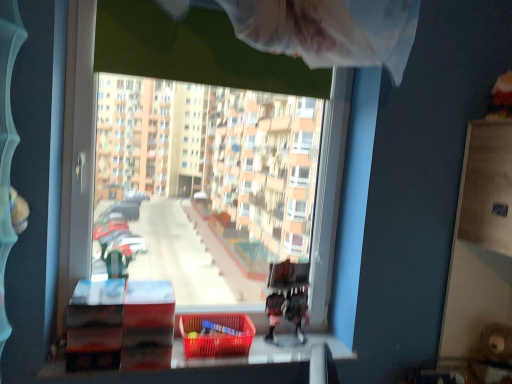
Question: Considering the positions of point (89, 109) and point (276, 271), is point (89, 109) closer or farther from the camera than point (276, 271)?

Choices:
 (A) closer
 (B) farther

Answer: (A)

Question: In the image, is transparent plastic window at center on the left side or the right side of wooden bunk bed at center?

Choices:
 (A) left
 (B) right

Answer: (A)

Question: Which object is positioned closest to the transparent plastic window at center?

Choices:
 (A) translucent plastic basket at lower center
 (B) wooden bunk bed at center

Answer: (A)

Question: Estimate the real-world distances between objects in this image. Which object is farther from the transparent plastic window at center?

Choices:
 (A) wooden bunk bed at center
 (B) translucent plastic basket at lower center

Answer: (A)